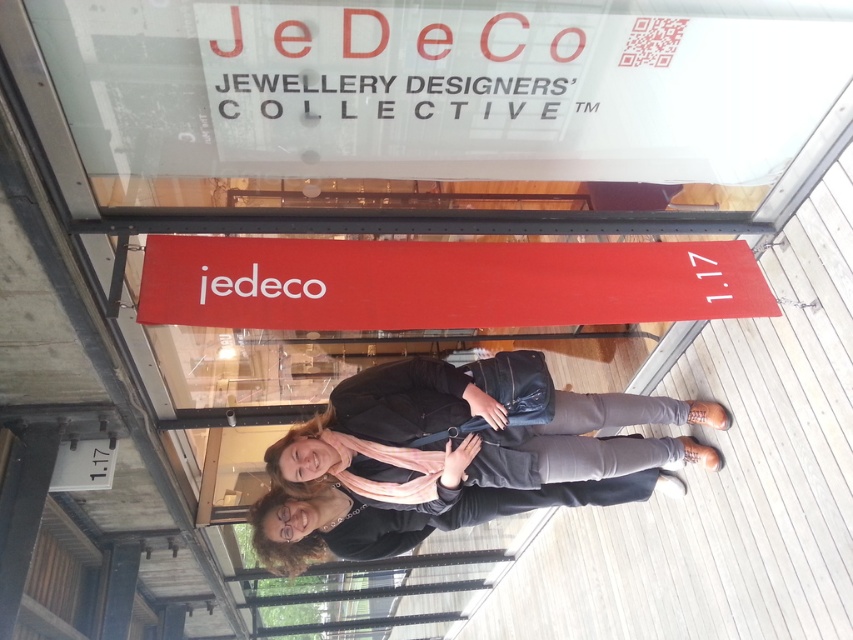
Question: Can you confirm if red matte sign at center is thinner than matte black jacket at center?

Choices:
 (A) yes
 (B) no

Answer: (B)

Question: Among these points, which one is farthest from the camera?

Choices:
 (A) (711, 243)
 (B) (461, 436)

Answer: (A)

Question: Can you confirm if red matte sign at center is thinner than matte black jacket at center?

Choices:
 (A) yes
 (B) no

Answer: (B)

Question: Does red matte sign at center have a larger size compared to matte black jacket at center?

Choices:
 (A) yes
 (B) no

Answer: (B)